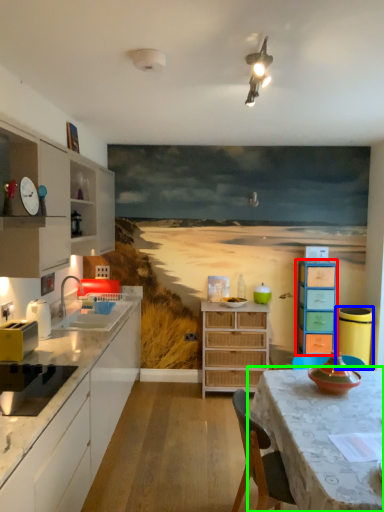
Question: Estimate the real-world distances between objects in this image. Which object is closer to chest of drawers (highlighted by a red box), appliance (highlighted by a blue box) or table (highlighted by a green box)?

Choices:
 (A) appliance
 (B) table

Answer: (A)